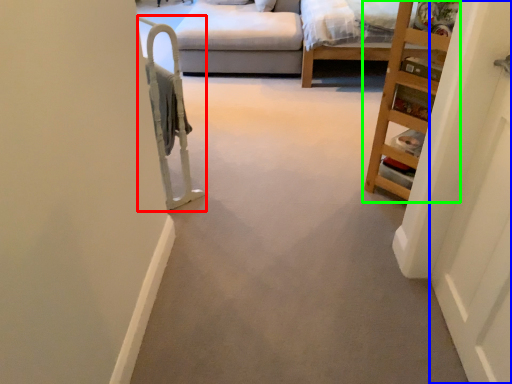
Question: Estimate the real-world distances between objects in this image. Which object is closer to bunk bed (highlighted by a red box), door (highlighted by a blue box) or furniture (highlighted by a green box)?

Choices:
 (A) door
 (B) furniture

Answer: (B)